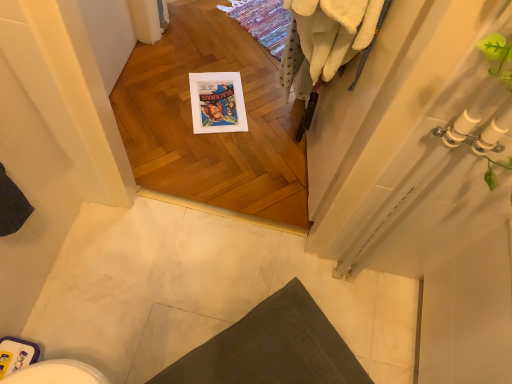
Question: Is dark gray fabric bath mat at lower center turned away from white fluffy bath towel at upper right?

Choices:
 (A) yes
 (B) no

Answer: (B)

Question: Is dark gray fabric bath mat at lower center with white fluffy bath towel at upper right?

Choices:
 (A) no
 (B) yes

Answer: (A)

Question: Is dark gray fabric bath mat at lower center aimed at white fluffy bath towel at upper right?

Choices:
 (A) yes
 (B) no

Answer: (B)

Question: Considering the relative sizes of dark gray fabric bath mat at lower center and white fluffy bath towel at upper right in the image provided, is dark gray fabric bath mat at lower center thinner than white fluffy bath towel at upper right?

Choices:
 (A) yes
 (B) no

Answer: (B)

Question: Considering the relative sizes of dark gray fabric bath mat at lower center and white fluffy bath towel at upper right in the image provided, is dark gray fabric bath mat at lower center shorter than white fluffy bath towel at upper right?

Choices:
 (A) no
 (B) yes

Answer: (B)

Question: From a real-world perspective, is dark gray fabric bath mat at lower center positioned under white fluffy bath towel at upper right based on gravity?

Choices:
 (A) no
 (B) yes

Answer: (B)

Question: Does white fluffy bath towel at upper right have a lesser width compared to dark gray fabric bath mat at lower center?

Choices:
 (A) yes
 (B) no

Answer: (A)

Question: Does white fluffy bath towel at upper right lie behind dark gray fabric bath mat at lower center?

Choices:
 (A) no
 (B) yes

Answer: (A)

Question: Considering the relative positions of white fluffy bath towel at upper right and dark gray fabric bath mat at lower center in the image provided, is white fluffy bath towel at upper right to the left of dark gray fabric bath mat at lower center from the viewer's perspective?

Choices:
 (A) no
 (B) yes

Answer: (A)

Question: From a real-world perspective, is white fluffy bath towel at upper right over dark gray fabric bath mat at lower center?

Choices:
 (A) no
 (B) yes

Answer: (B)

Question: Considering the relative positions of white fluffy bath towel at upper right and dark gray fabric bath mat at lower center in the image provided, is white fluffy bath towel at upper right to the right of dark gray fabric bath mat at lower center from the viewer's perspective?

Choices:
 (A) yes
 (B) no

Answer: (A)

Question: Would you say white fluffy bath towel at upper right is a long distance from dark gray fabric bath mat at lower center?

Choices:
 (A) no
 (B) yes

Answer: (A)

Question: Based on their sizes in the image, would you say white fluffy bath towel at upper right is bigger or smaller than dark gray fabric bath mat at lower center?

Choices:
 (A) small
 (B) big

Answer: (B)